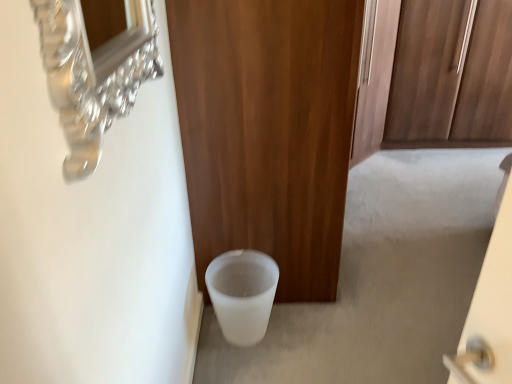
Question: In terms of height, does wooden door at center look taller or shorter compared to white matte trash can at lower center?

Choices:
 (A) short
 (B) tall

Answer: (B)

Question: In the image, is wooden door at center positioned in front of or behind white matte trash can at lower center?

Choices:
 (A) front
 (B) behind

Answer: (A)

Question: Which object is the farthest from the white frosted glass toilet bowl at lower left?

Choices:
 (A) white matte trash can at lower center
 (B) wooden door at center

Answer: (A)

Question: Which object is the closest to the white frosted glass toilet bowl at lower left?

Choices:
 (A) white matte trash can at lower center
 (B) wooden door at center

Answer: (B)